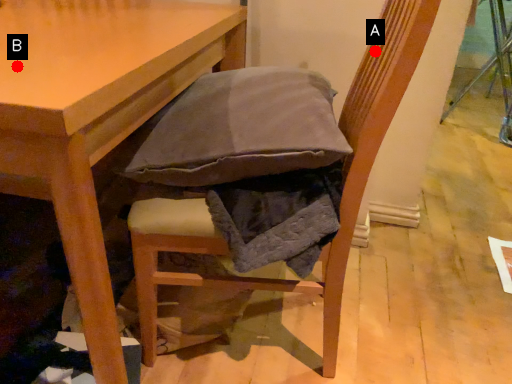
Question: Two points are circled on the image, labeled by A and B beside each circle. Among these points, which one is nearest to the camera?

Choices:
 (A) A is closer
 (B) B is closer

Answer: (B)